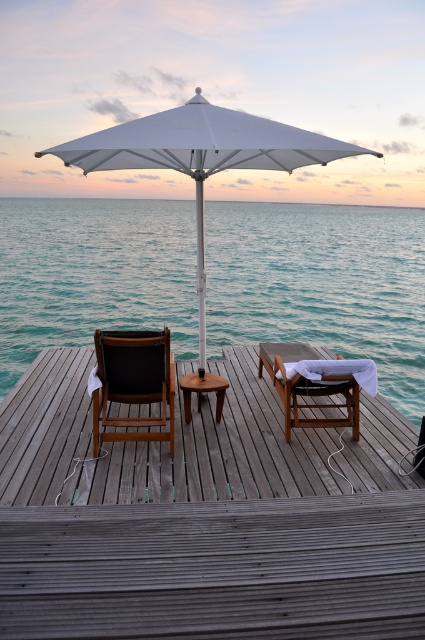
Question: Which object is farther from the camera taking this photo?

Choices:
 (A) white fabric umbrella at center
 (B) brown wooden stool at center
 (C) wooden beach chair at center

Answer: (B)

Question: Does white fabric umbrella at center have a lesser width compared to dark brown wood beach chair at center?

Choices:
 (A) no
 (B) yes

Answer: (A)

Question: Can you confirm if dark brown wood beach chair at center is positioned above brown wooden stool at center?

Choices:
 (A) no
 (B) yes

Answer: (B)

Question: Which point is closer to the camera?

Choices:
 (A) dark brown wood beach chair at center
 (B) wooden at center
 (C) brown wooden stool at center
 (D) white fabric umbrella at center

Answer: (D)

Question: Does wooden at center have a greater width compared to dark brown wood beach chair at center?

Choices:
 (A) no
 (B) yes

Answer: (B)

Question: Which point is closer to the camera?

Choices:
 (A) (223, 388)
 (B) (167, 346)

Answer: (B)